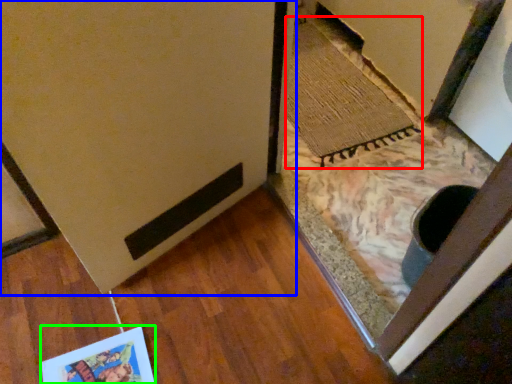
Question: Based on their relative distances, which object is farther from doormat (highlighted by a red box)? Choose from door (highlighted by a blue box) and postcard (highlighted by a green box).

Choices:
 (A) door
 (B) postcard

Answer: (B)